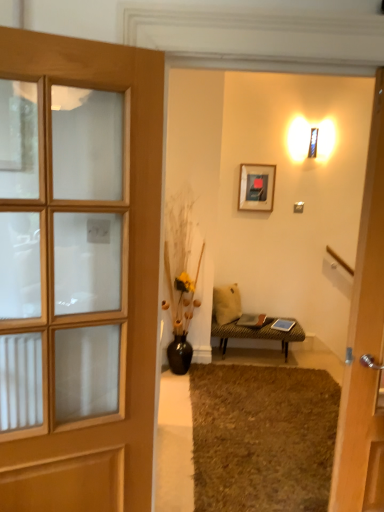
The height and width of the screenshot is (512, 384). Find the location of `free region under leather textured bench at center (from a real-world perspective)`. free region under leather textured bench at center (from a real-world perspective) is located at coordinates (263, 360).